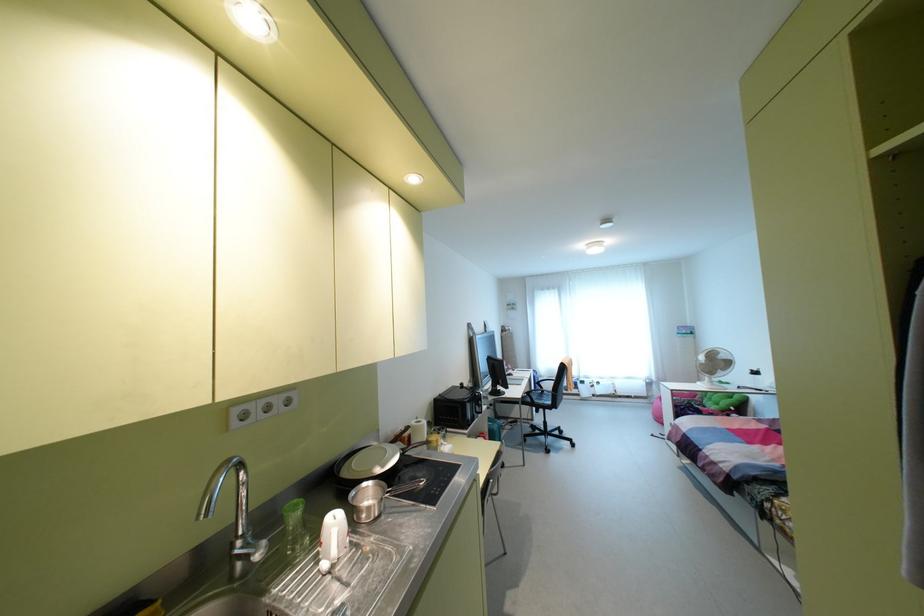
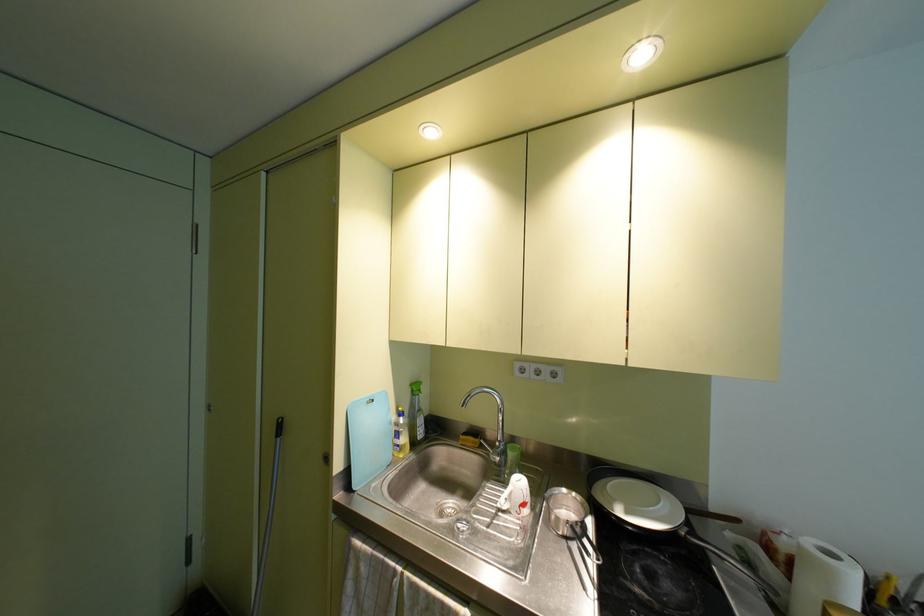
Question: The camera is either moving clockwise (left) or counter-clockwise (right) around the object. The first image is from the beginning of the video and the second image is from the end. Is the camera moving left or right when shooting the video?

Choices:
 (A) Left
 (B) Right

Answer: (B)